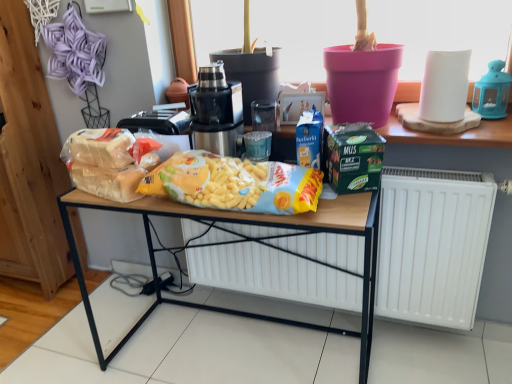
Question: Can you confirm if black metallic juicer at center is wider than blue plastic lantern at upper right?

Choices:
 (A) yes
 (B) no

Answer: (A)

Question: Does black metallic juicer at center have a lesser width compared to blue plastic lantern at upper right?

Choices:
 (A) yes
 (B) no

Answer: (B)

Question: From the image's perspective, is black metallic juicer at center beneath blue plastic lantern at upper right?

Choices:
 (A) no
 (B) yes

Answer: (B)

Question: Is blue plastic lantern at upper right at the back of black metallic juicer at center?

Choices:
 (A) no
 (B) yes

Answer: (A)

Question: Considering the relative sizes of black metallic juicer at center and blue plastic lantern at upper right in the image provided, is black metallic juicer at center shorter than blue plastic lantern at upper right?

Choices:
 (A) yes
 (B) no

Answer: (B)

Question: Considering the relative sizes of black metallic juicer at center and blue plastic lantern at upper right in the image provided, is black metallic juicer at center taller than blue plastic lantern at upper right?

Choices:
 (A) yes
 (B) no

Answer: (A)

Question: Is blue plastic lantern at upper right in contact with yellow matte snack packet at center, which is the 2th waste from left to right?

Choices:
 (A) yes
 (B) no

Answer: (B)

Question: Is blue plastic lantern at upper right facing away from yellow matte snack packet at center, which is the 2th waste from left to right?

Choices:
 (A) no
 (B) yes

Answer: (A)

Question: Can you confirm if blue plastic lantern at upper right is shorter than yellow matte snack packet at center, the 1th waste when ordered from right to left?

Choices:
 (A) yes
 (B) no

Answer: (B)

Question: From the image's perspective, is blue plastic lantern at upper right under yellow matte snack packet at center, the 1th waste when ordered from right to left?

Choices:
 (A) yes
 (B) no

Answer: (B)

Question: Is yellow matte snack packet at center, the 1th waste when ordered from right to left, inside blue plastic lantern at upper right?

Choices:
 (A) yes
 (B) no

Answer: (B)

Question: From a real-world perspective, is blue plastic lantern at upper right physically above yellow matte snack packet at center, the 1th waste when ordered from right to left?

Choices:
 (A) no
 (B) yes

Answer: (B)

Question: Is green matte lunch box at center far from wooden shelf at upper center?

Choices:
 (A) no
 (B) yes

Answer: (A)